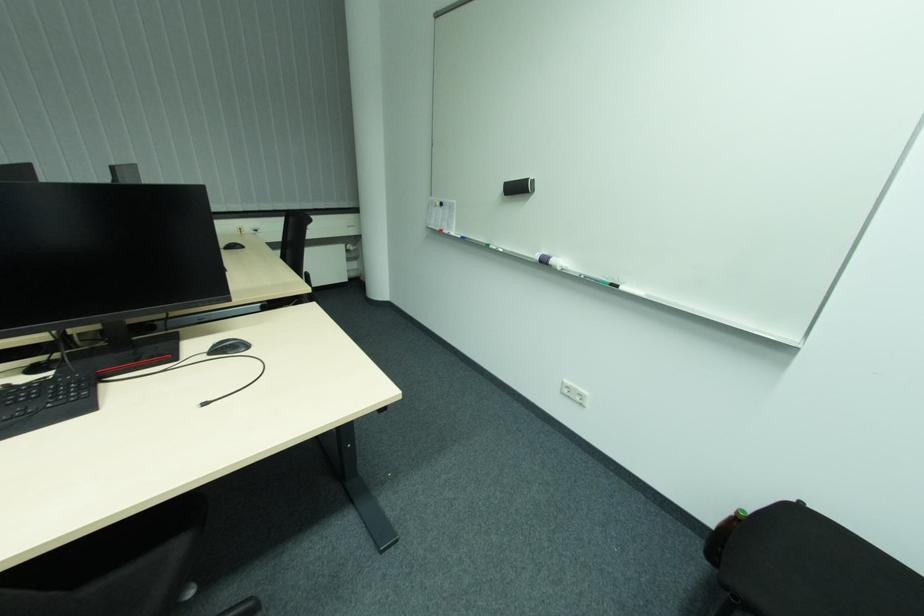
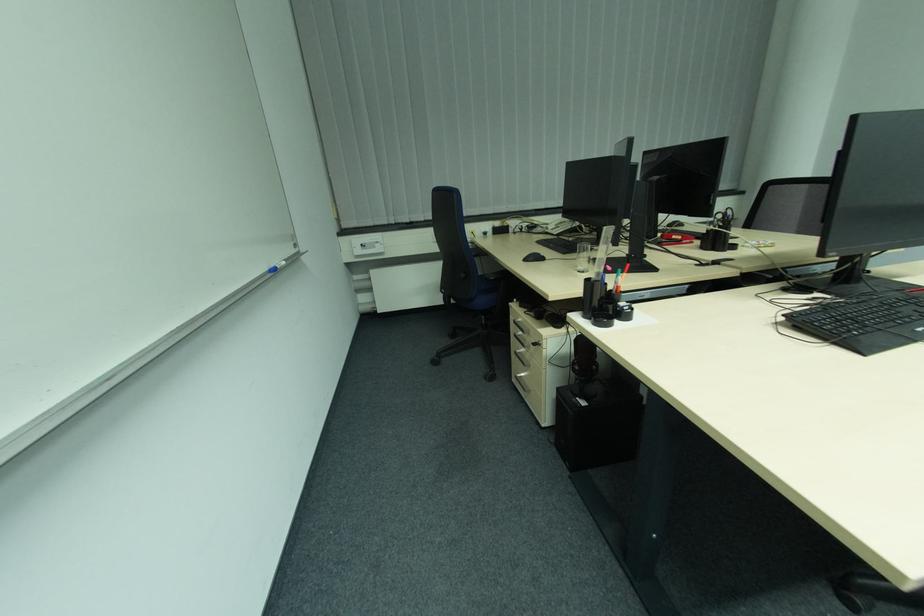
Question: Which direction would the cameraman need to move to produce the second image? Reply with the corresponding letter.

Choices:
 (A) Left
 (B) Right
 (C) Forward
 (D) Backward

Answer: (A)